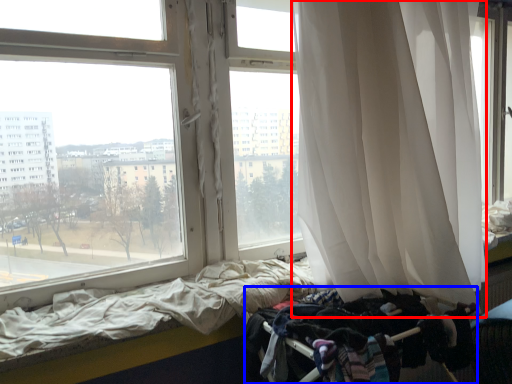
Question: Which object appears closest to the camera in this image, curtain (highlighted by a red box) or baby carriage (highlighted by a blue box)?

Choices:
 (A) curtain
 (B) baby carriage

Answer: (A)